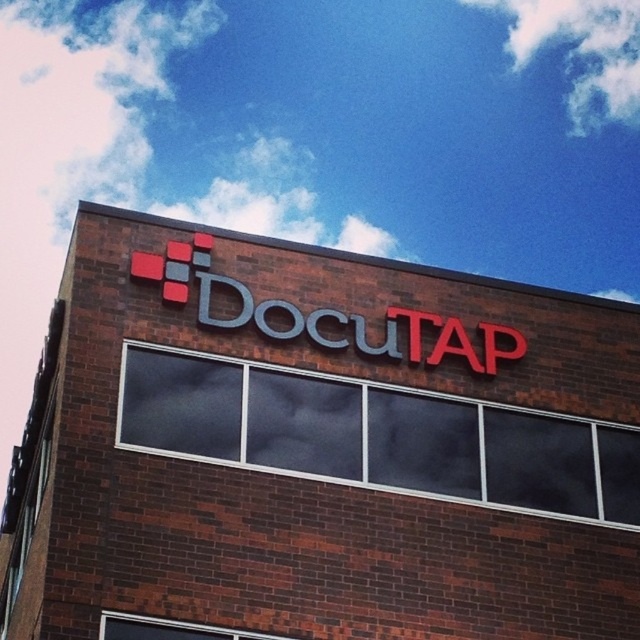
Which of these two, metallic sign at center or matte plastic sign at upper center, stands taller?

Standing taller between the two is metallic sign at center.

Can you confirm if metallic sign at center is thinner than matte plastic sign at upper center?

Incorrect, metallic sign at center's width is not less than matte plastic sign at upper center's.

Is point (470, 349) in front of point (182, 273)?

No, it is not.

The width and height of the screenshot is (640, 640). What are the coordinates of `metallic sign at center` in the screenshot? It's located at (317, 449).